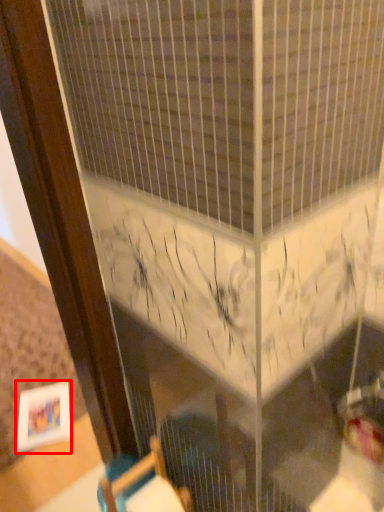
Question: From the image's perspective, what is the correct spatial relationship of picture frame (annotated by the red box) in relation to furniture?

Choices:
 (A) below
 (B) above

Answer: (A)